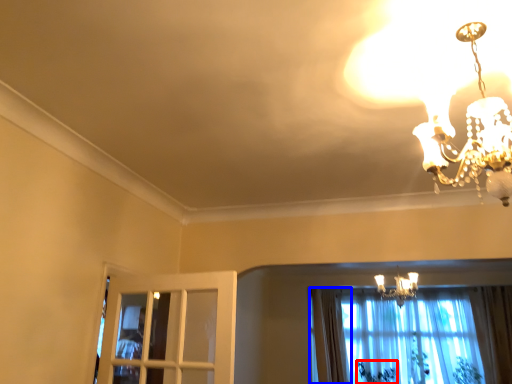
Question: Among these objects, which one is farthest to the camera, plant (highlighted by a red box) or curtain (highlighted by a blue box)?

Choices:
 (A) plant
 (B) curtain

Answer: (A)